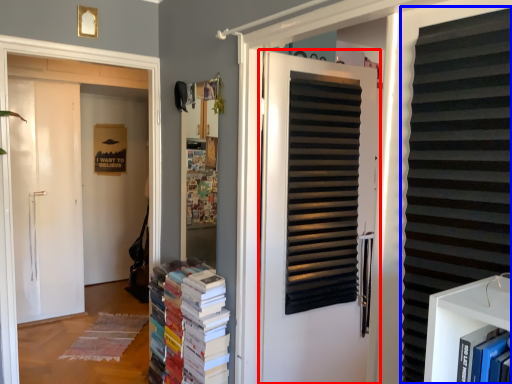
Question: Which object is further to the camera taking this photo, door (highlighted by a red box) or shutter (highlighted by a blue box)?

Choices:
 (A) door
 (B) shutter

Answer: (A)